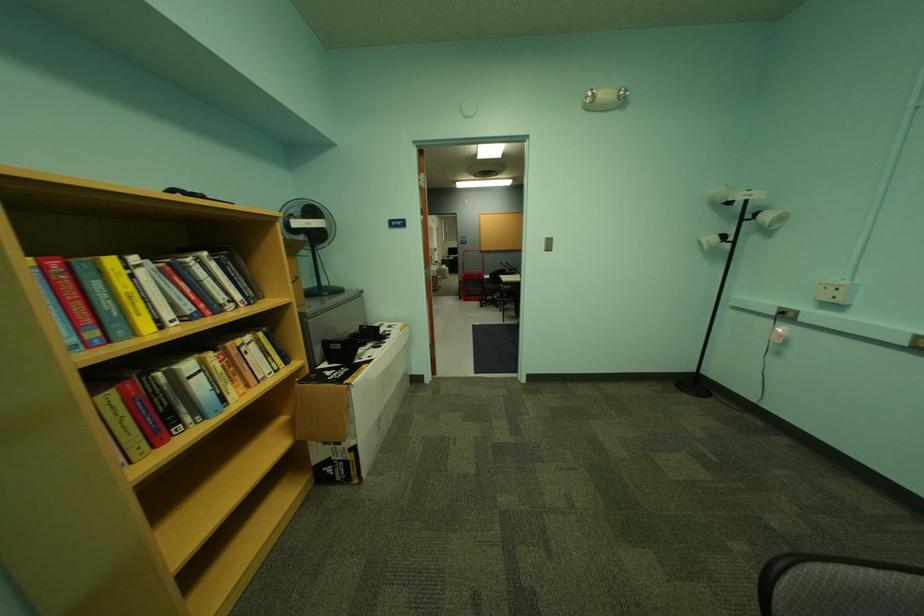
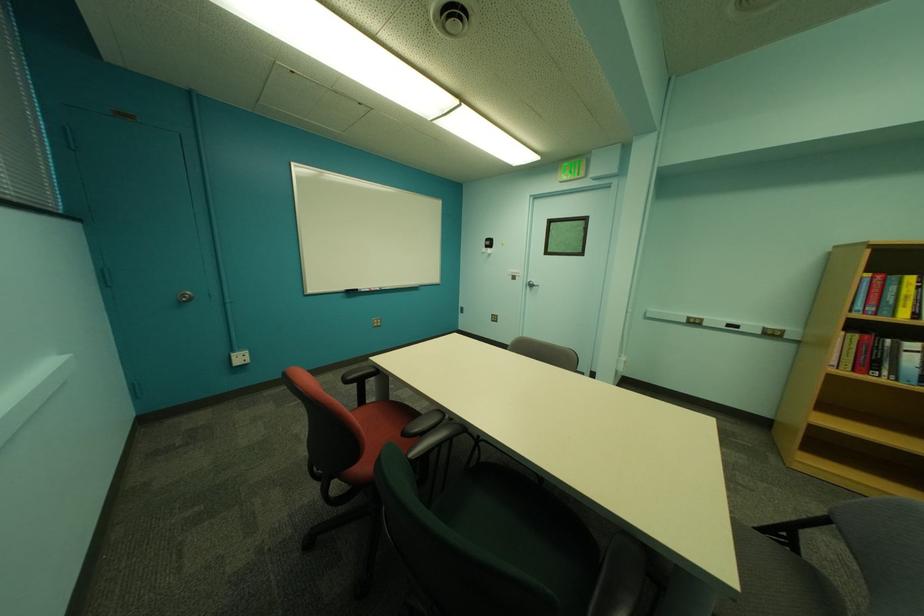
The point at (180, 377) is marked in the first image. Where is the corresponding point in the second image?

(906, 346)